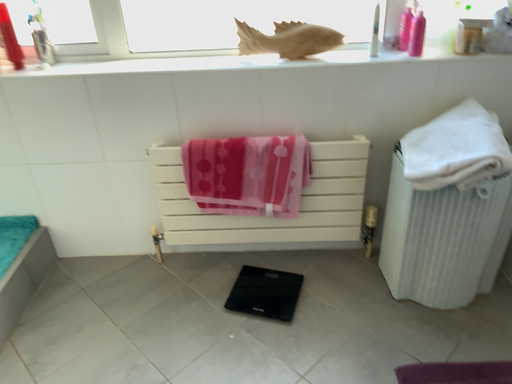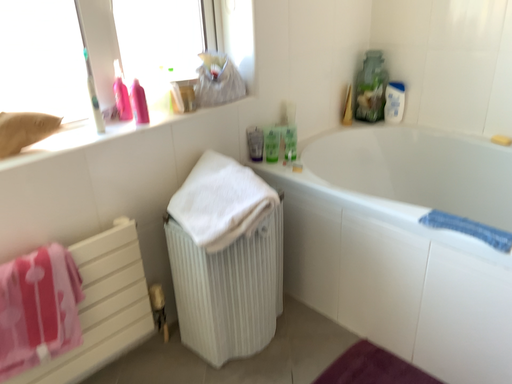
Question: Which way did the camera rotate in the video?

Choices:
 (A) rotated right
 (B) rotated left

Answer: (A)